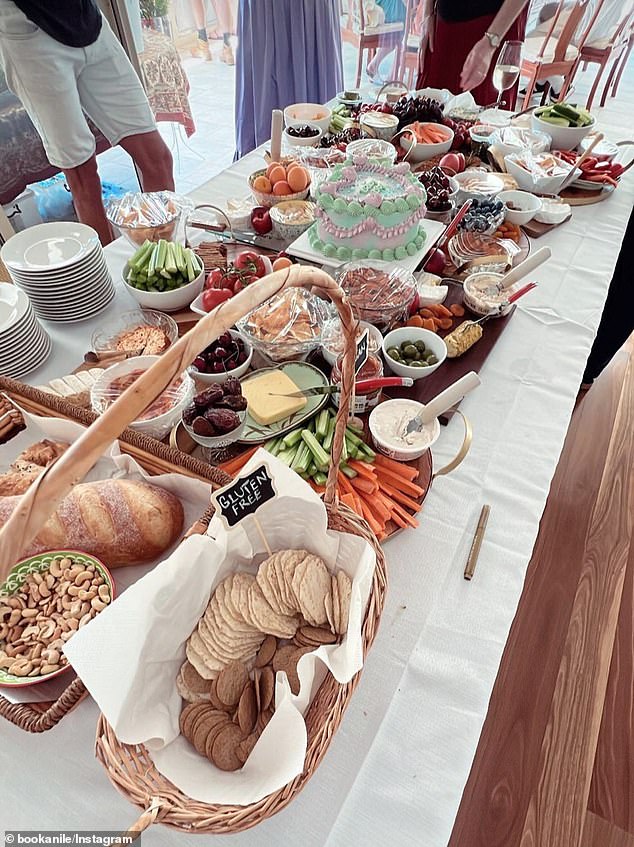
The width and height of the screenshot is (634, 847). Find the location of `basket on handle`. basket on handle is located at coordinates (134, 388).